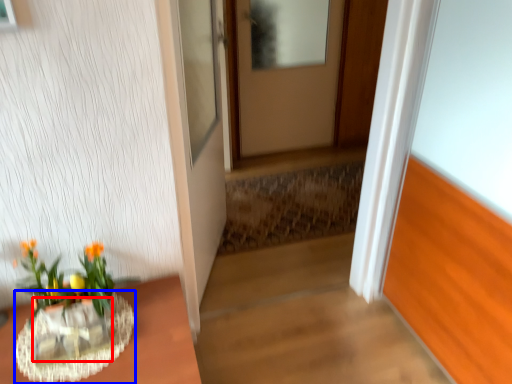
Question: Which object appears farthest to the camera in this image, glass vase (highlighted by a red box) or vase (highlighted by a blue box)?

Choices:
 (A) glass vase
 (B) vase

Answer: (A)